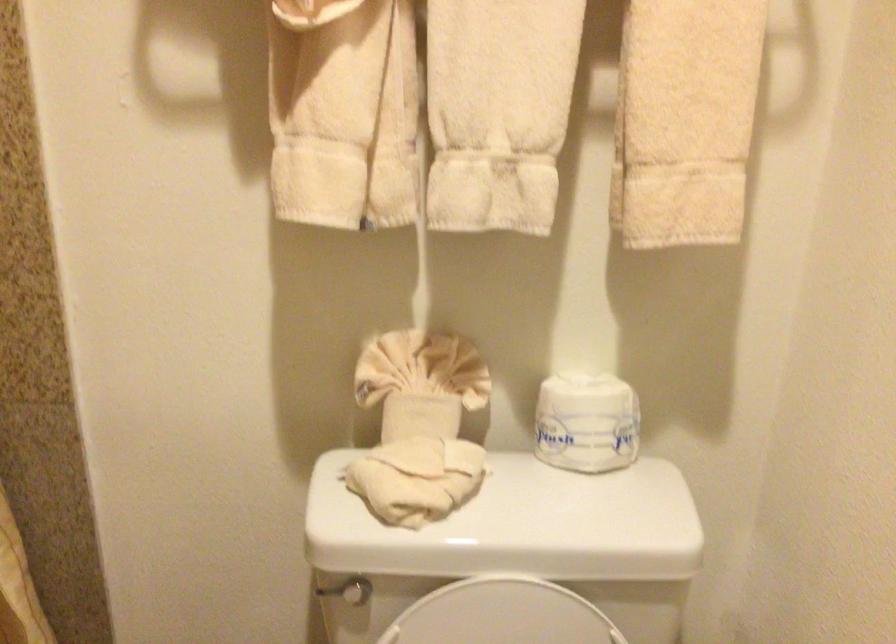
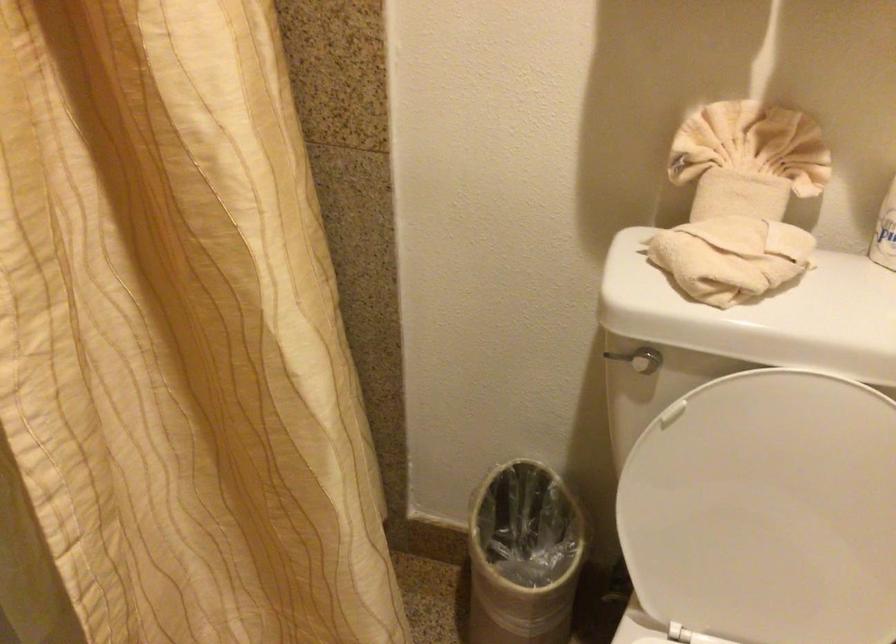
Question: The camera is either moving clockwise (left) or counter-clockwise (right) around the object. The first image is from the beginning of the video and the second image is from the end. Is the camera moving left or right when shooting the video?

Choices:
 (A) Left
 (B) Right

Answer: (B)